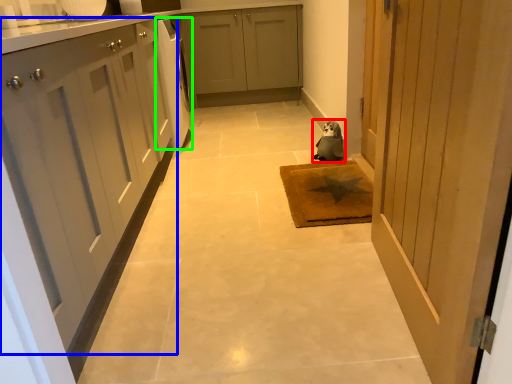
Question: Considering the real-world distances, which object is farthest from animal (highlighted by a red box)? cabinetry (highlighted by a blue box) or dish washer (highlighted by a green box)?

Choices:
 (A) cabinetry
 (B) dish washer

Answer: (A)